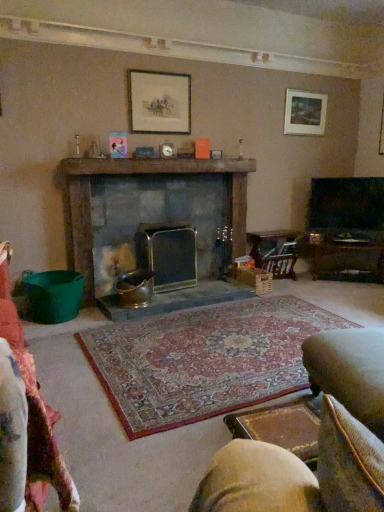
Question: Does velvet beige swivel chair at lower right, positioned as the second swivel chair in left-to-right order, have a smaller size compared to metallic silver fireplace at center, the second fireplace viewed from the left?

Choices:
 (A) no
 (B) yes

Answer: (A)

Question: Is velvet beige swivel chair at lower right, positioned as the second swivel chair in left-to-right order, positioned with its back to metallic silver fireplace at center, the second fireplace viewed from the left?

Choices:
 (A) yes
 (B) no

Answer: (B)

Question: Is velvet beige swivel chair at lower right, positioned as the second swivel chair in left-to-right order, positioned in front of metallic silver fireplace at center, which is counted as the 1th fireplace, starting from the right?

Choices:
 (A) yes
 (B) no

Answer: (A)

Question: Is velvet beige swivel chair at lower right, which is counted as the 1th swivel chair, starting from the back, facing towards metallic silver fireplace at center, the second fireplace viewed from the left?

Choices:
 (A) yes
 (B) no

Answer: (A)

Question: Does velvet beige swivel chair at lower right, placed as the 1th swivel chair when sorted from right to left, have a greater width compared to metallic silver fireplace at center, the second fireplace viewed from the left?

Choices:
 (A) no
 (B) yes

Answer: (B)

Question: Is matte wooden picture frame at upper center, which is the second picture frame in right-to-left order, in front of or behind wooden magazine rack at center-right in the image?

Choices:
 (A) front
 (B) behind

Answer: (A)

Question: In terms of height, does matte wooden picture frame at upper center, the first picture frame positioned from the left, look taller or shorter compared to wooden magazine rack at center-right?

Choices:
 (A) tall
 (B) short

Answer: (A)

Question: Considering the relative positions of matte wooden picture frame at upper center, arranged as the first picture frame when viewed from the front, and wooden magazine rack at center-right in the image provided, is matte wooden picture frame at upper center, arranged as the first picture frame when viewed from the front, to the left or to the right of wooden magazine rack at center-right?

Choices:
 (A) right
 (B) left

Answer: (B)

Question: In terms of width, does matte wooden picture frame at upper center, the first picture frame positioned from the left, look wider or thinner when compared to wooden magazine rack at center-right?

Choices:
 (A) thin
 (B) wide

Answer: (A)

Question: Is matte wooden picture frame at upper center, which is the second picture frame in right-to-left order, to the left or to the right of rustic stone fireplace at center, which is counted as the 1th fireplace, starting from the left, in the image?

Choices:
 (A) left
 (B) right

Answer: (A)

Question: Is point (142, 133) closer or farther from the camera than point (77, 174)?

Choices:
 (A) farther
 (B) closer

Answer: (A)

Question: Is matte wooden picture frame at upper center, which is the second picture frame in right-to-left order, situated inside rustic stone fireplace at center, which is counted as the 1th fireplace, starting from the left, or outside?

Choices:
 (A) inside
 (B) outside

Answer: (B)

Question: From a real-world perspective, is matte wooden picture frame at upper center, which is the second picture frame in right-to-left order, above or below rustic stone fireplace at center, positioned as the 2th fireplace in right-to-left order?

Choices:
 (A) above
 (B) below

Answer: (A)

Question: Is point (304, 238) positioned closer to the camera than point (294, 125)?

Choices:
 (A) farther
 (B) closer

Answer: (A)

Question: Looking at their shapes, would you say wooden magazine rack at center-right is wider or thinner than matte wooden picture frame at upper right, which is counted as the 2th picture frame, starting from the front?

Choices:
 (A) thin
 (B) wide

Answer: (B)